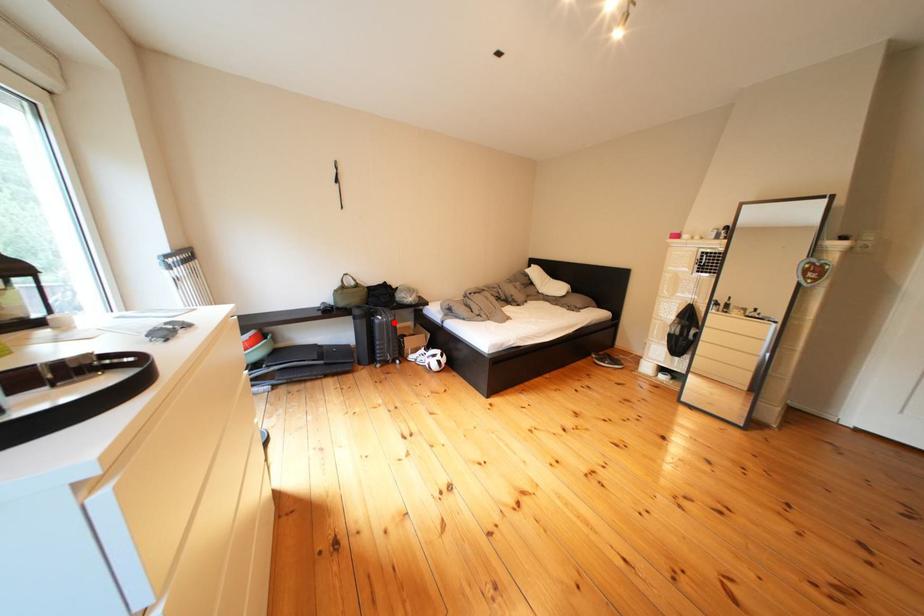
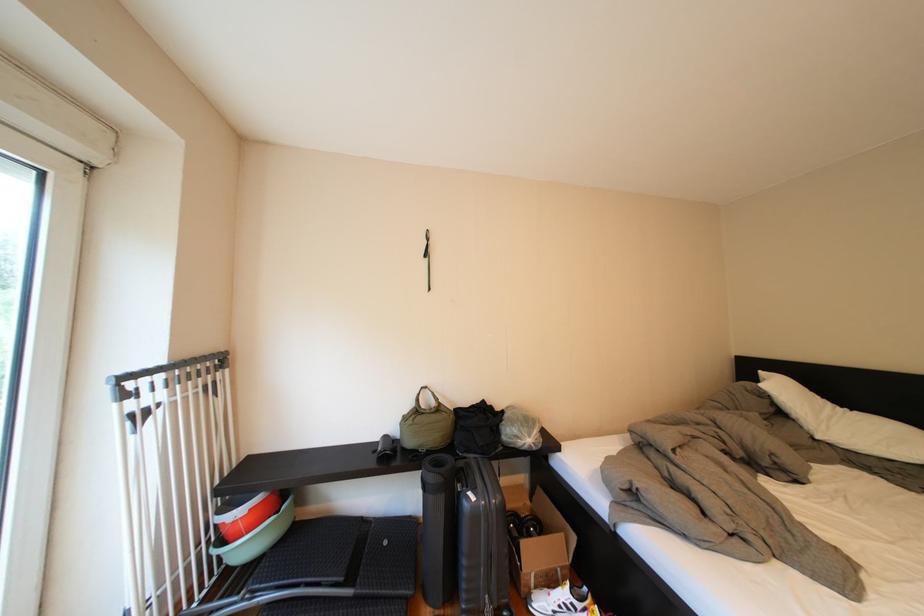
The point at the highlighted location is marked in the first image. Where is the corresponding point in the second image?

(487, 503)